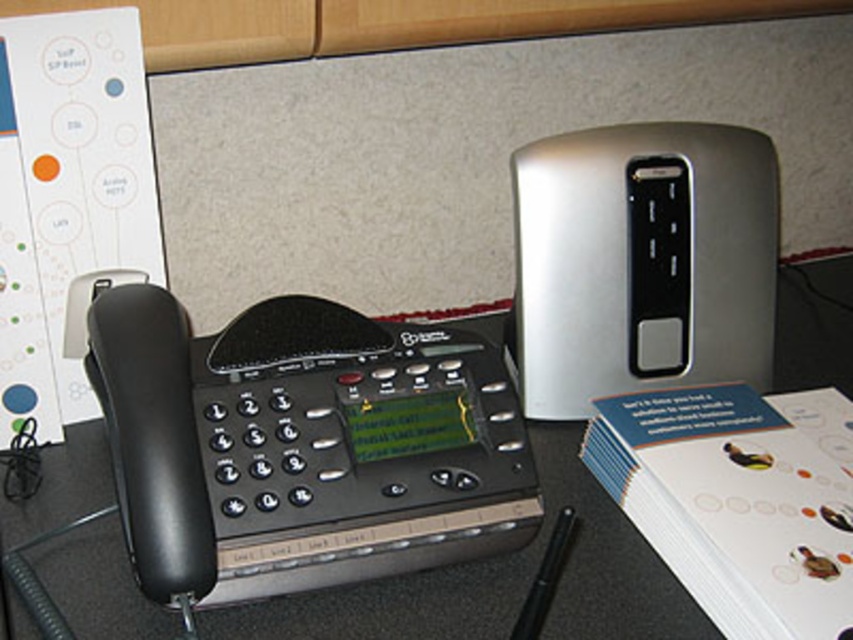
You are setting up a new desk and want to place a 10 inch wide laptop between the silver metallic speaker at upper right and the black plastic phone at left. Will there be enough space for the laptop to fit between them?

The silver metallic speaker at upper right and the black plastic phone at left are 9.96 inches apart from each other. Since the laptop is 10 inches wide, it will not fit between them as the space is slightly narrower than the laptop.

You are standing in front of the desk setup and want to reach a point that is 33.30 inches away from you. Can you confirm if the point at coordinates point (741, 253) is exactly at that distance?

The distance of point (741, 253) from viewer is 33.30 inches, so yes, the point at coordinates point (741, 253) is exactly at that distance.

You are setting up a desk and want to place the silver metallic speaker at upper right and the black plastic phone at left. If you need to stack them vertically, which one should go on the bottom to ensure stability?

The silver metallic speaker at upper right should be placed at the bottom since it is taller than the black plastic phone at left, providing a stable base for stacking.